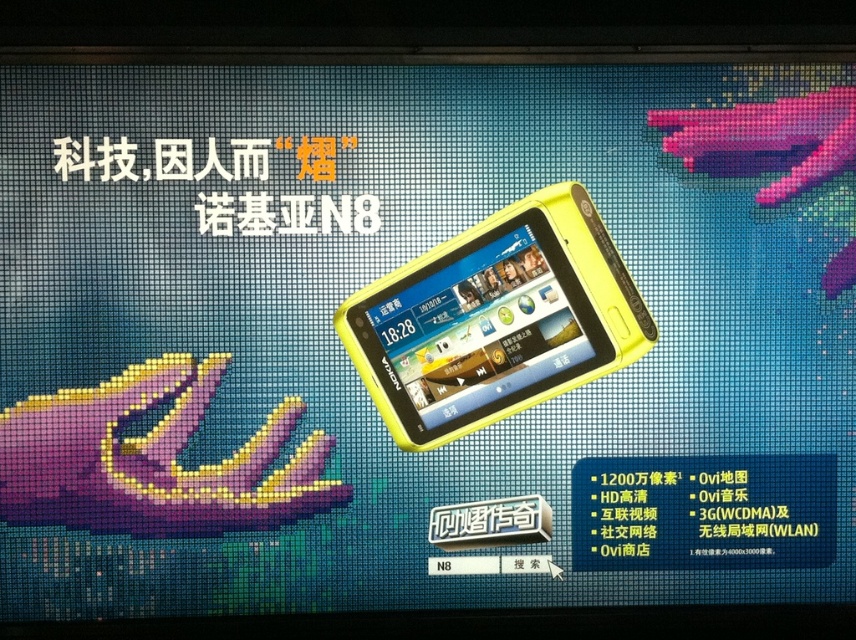
Question: Is yellow plastic smartphone at center thinner than matte pink plastic hand at upper right?

Choices:
 (A) yes
 (B) no

Answer: (B)

Question: Can you confirm if yellow plastic smartphone at center is wider than purple matte hand at lower left?

Choices:
 (A) yes
 (B) no

Answer: (B)

Question: Which object is farther from the camera taking this photo?

Choices:
 (A) purple matte hand at lower left
 (B) matte pink plastic hand at upper right
 (C) yellow plastic smartphone at center

Answer: (B)

Question: Estimate the real-world distances between objects in this image. Which object is farther from the yellow plastic smartphone at center?

Choices:
 (A) purple matte hand at lower left
 (B) matte pink plastic hand at upper right

Answer: (B)

Question: Which point is farther to the camera?

Choices:
 (A) matte pink plastic hand at upper right
 (B) purple matte hand at lower left
 (C) yellow plastic smartphone at center

Answer: (A)

Question: Observing the image, what is the correct spatial positioning of purple matte hand at lower left in reference to matte pink plastic hand at upper right?

Choices:
 (A) below
 (B) above

Answer: (A)